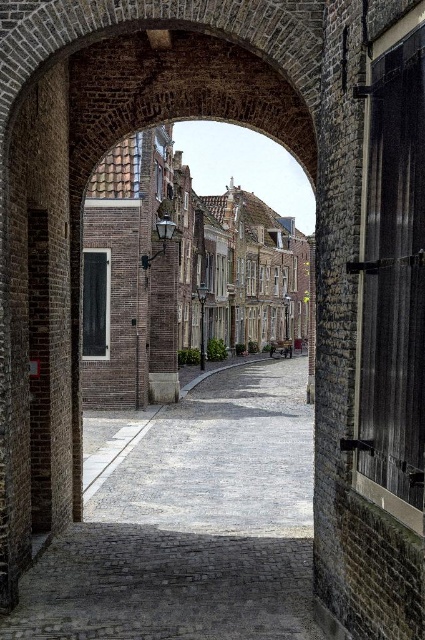
Question: Does gray cobblestone alley at center come behind brick building at center?

Choices:
 (A) yes
 (B) no

Answer: (B)

Question: Which point is closer to the camera?

Choices:
 (A) brick building at center
 (B) gray cobblestone alley at center

Answer: (B)

Question: Can you confirm if gray cobblestone alley at center is thinner than brick building at center?

Choices:
 (A) no
 (B) yes

Answer: (B)

Question: Which point is closer to the camera?

Choices:
 (A) (251, 305)
 (B) (138, 531)

Answer: (B)

Question: Can you confirm if gray cobblestone alley at center is positioned above brick building at center?

Choices:
 (A) yes
 (B) no

Answer: (B)